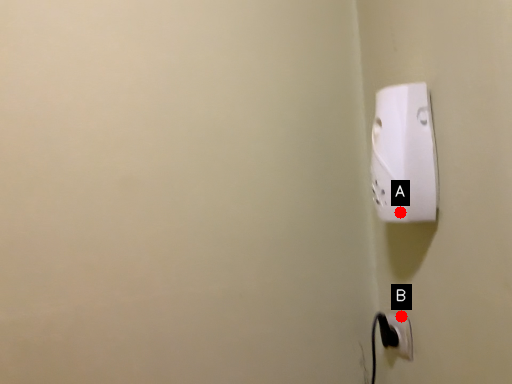
Question: Two points are circled on the image, labeled by A and B beside each circle. Which point is closer to the camera?

Choices:
 (A) A is closer
 (B) B is closer

Answer: (A)